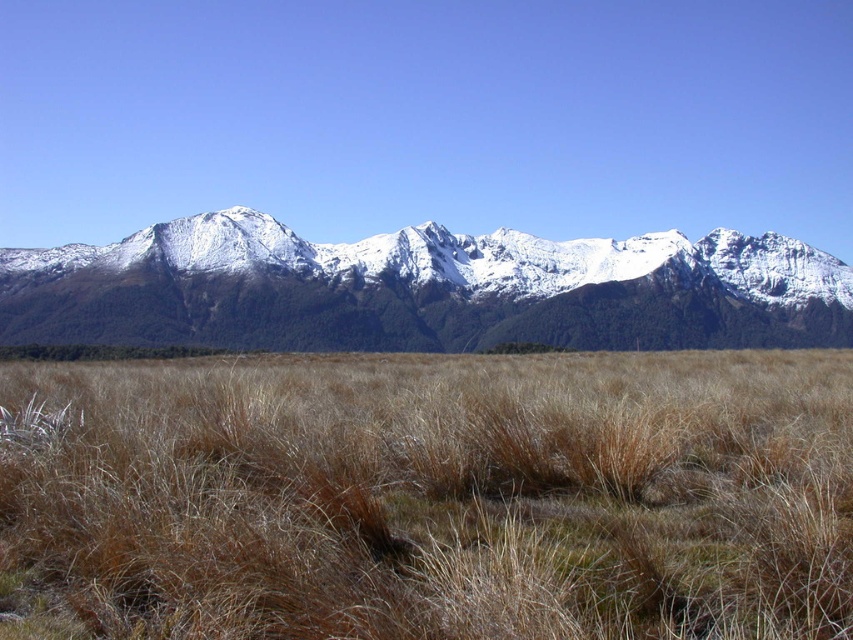
Question: Does brown dry grass at center have a larger size compared to white snow-covered mountain range at center?

Choices:
 (A) no
 (B) yes

Answer: (A)

Question: Considering the relative positions of brown dry grass at center and white snow-covered mountain range at center in the image provided, where is brown dry grass at center located with respect to white snow-covered mountain range at center?

Choices:
 (A) above
 (B) below

Answer: (B)

Question: Which object is closer to the camera taking this photo?

Choices:
 (A) brown dry grass at center
 (B) white snow-covered mountain range at center

Answer: (A)

Question: Can you confirm if brown dry grass at center is positioned to the left of white snow-covered mountain range at center?

Choices:
 (A) no
 (B) yes

Answer: (B)